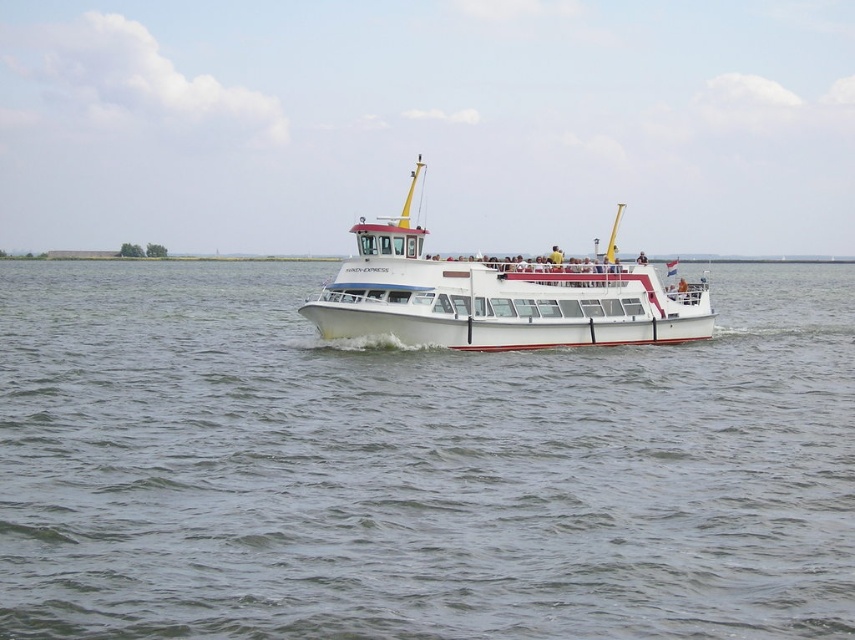
Is white water at center smaller than white glossy boat at center?

Yes.

Is white water at center in front of white glossy boat at center?

Yes, it is.

The image size is (855, 640). I want to click on white water at center, so click(416, 467).

I want to click on white water at center, so click(x=416, y=467).